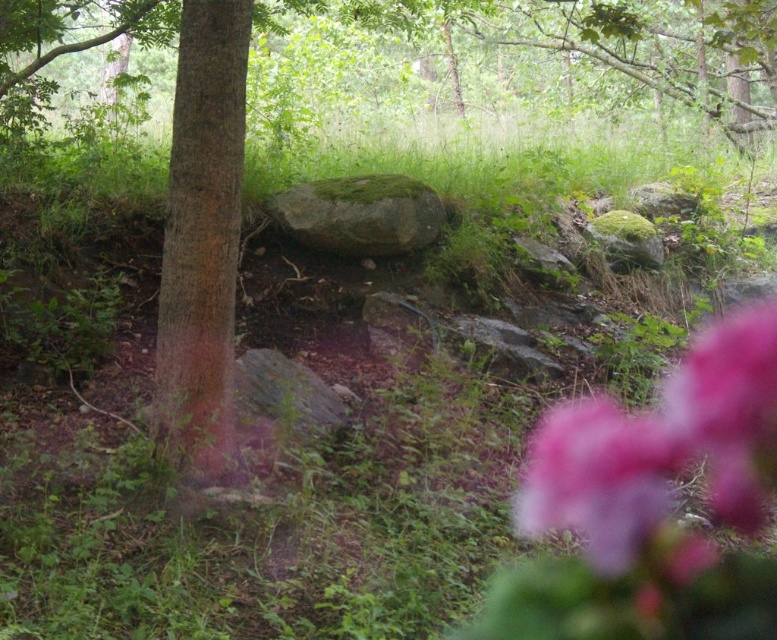
Question: Which of the following is the farthest from the observer?

Choices:
 (A) (215, 92)
 (B) (368, 177)

Answer: (B)

Question: Is pink matte flower at lower right further to the viewer compared to green mossy rock at center?

Choices:
 (A) no
 (B) yes

Answer: (A)

Question: In this image, where is pink fuzzy flower at lower right located relative to brown rough bark tree at center?

Choices:
 (A) left
 (B) right

Answer: (B)

Question: Which point is farther from the camera taking this photo?

Choices:
 (A) (598, 531)
 (B) (323, 244)
 (C) (225, 234)
 (D) (664, 433)

Answer: (B)

Question: Where is brown rough bark tree at center located in relation to green mossy rock at center in the image?

Choices:
 (A) above
 (B) below

Answer: (B)

Question: Which point is closer to the camera?

Choices:
 (A) green mossy rock at center
 (B) pink fuzzy flower at lower right
 (C) pink fluffy flower at lower right
 (D) brown rough bark tree at center

Answer: (B)